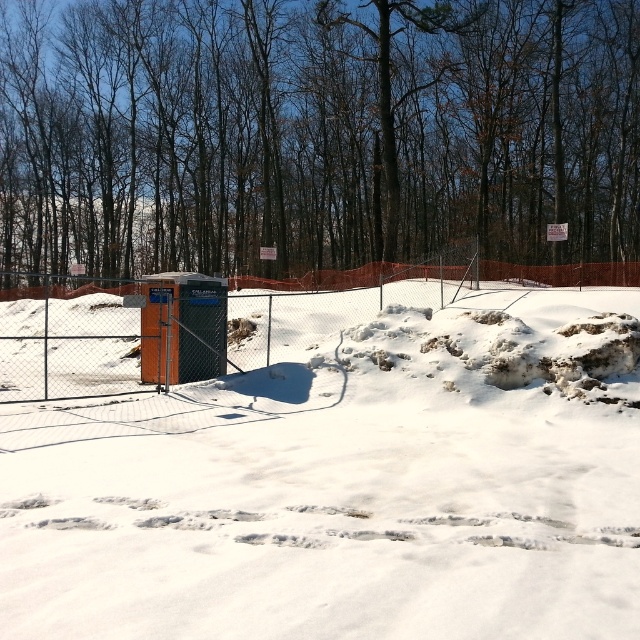
You are planning to build a snowman using the white powdery snow at center and need to check if there is enough space between it and the brown bark tree at center. Can you determine if the snow area is large enough to accommodate the snowman without being too close to the tree?

The white powdery snow at center occupies less space than brown bark tree at center, so the snow area may not be large enough to build a snowman without being too close to the tree.